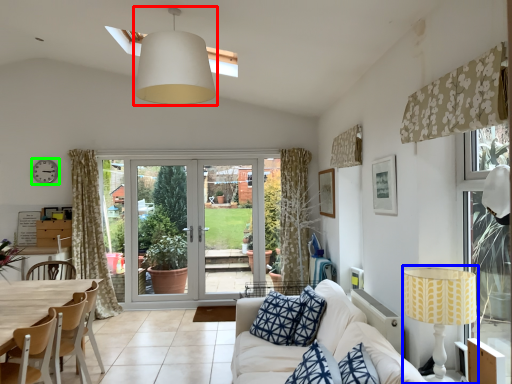
Question: Which is nearer to the lamp (highlighted by a red box)? table lamp (highlighted by a blue box) or clock (highlighted by a green box).

Choices:
 (A) table lamp
 (B) clock

Answer: (A)